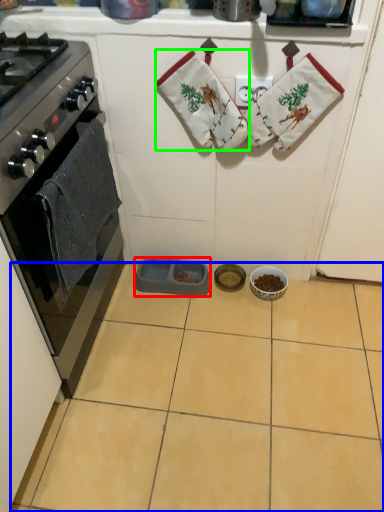
Question: Based on their relative distances, which object is farther from appliance (highlighted by a red box)? Choose from ceramic tile (highlighted by a blue box) and hand towel (highlighted by a green box).

Choices:
 (A) ceramic tile
 (B) hand towel

Answer: (B)